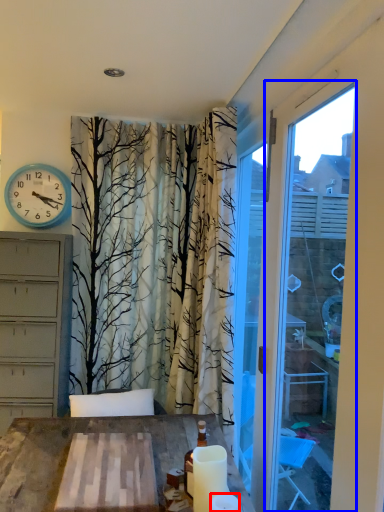
Question: Which point is further to the camera, candle (highlighted by a red box) or window frame (highlighted by a blue box)?

Choices:
 (A) candle
 (B) window frame

Answer: (A)